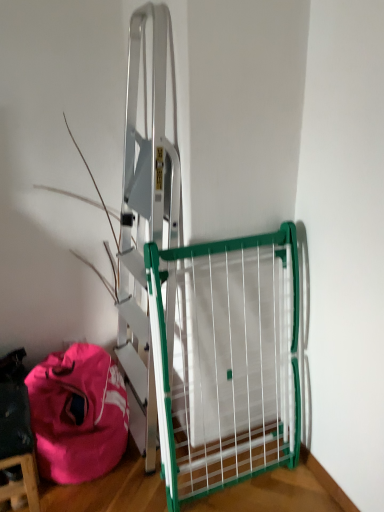
Describe the element at coordinates (78, 414) in the screenshot. The height and width of the screenshot is (512, 384). I see `pink fabric bean bag at lower left` at that location.

Where is `pink fabric bean bag at lower left`? This screenshot has height=512, width=384. pink fabric bean bag at lower left is located at coordinates (78, 414).

You are a GUI agent. You are given a task and a screenshot of the screen. Output one action in this format:
    pyautogui.click(x=<x>, y=<y>)
    Task: Click on the pink fabric bean bag at lower left
    The image size is (384, 512).
    Given the screenshot: What is the action you would take?
    pyautogui.click(x=78, y=414)